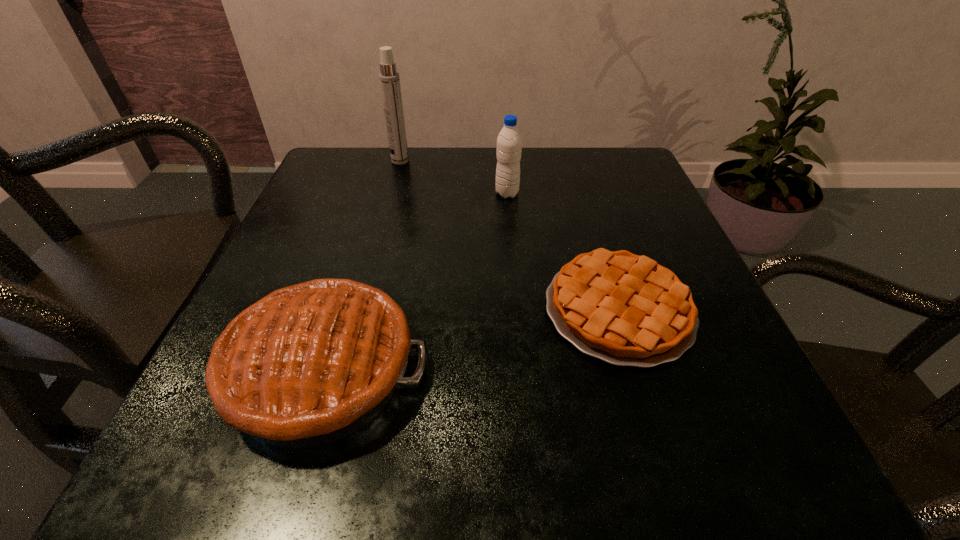
Locate an element on the screen. The image size is (960, 540). vacant region located 0.100m on the back of the taller pie is located at coordinates (355, 264).

The image size is (960, 540). Identify the location of free point located on the left of the rightmost object. (368, 310).

The height and width of the screenshot is (540, 960). What are the coordinates of `aerosol can present at the far edge` in the screenshot? It's located at (389, 78).

Locate an element on the screen. The image size is (960, 540). water bottle at the far edge is located at coordinates (509, 142).

This screenshot has width=960, height=540. In order to click on object at the near edge in this screenshot , I will do `click(308, 364)`.

Find the location of a particular element. This screenshot has height=540, width=960. aerosol can that is at the left edge is located at coordinates (389, 78).

I want to click on pie that is positioned at the left edge, so click(x=308, y=364).

At what (x,y) coordinates should I click in order to perform the action: click on object present at the right edge. Please return your answer as a coordinate pair (x, y). This screenshot has width=960, height=540. Looking at the image, I should click on (625, 309).

In order to click on object that is at the far left corner in this screenshot , I will do `click(389, 78)`.

You are a GUI agent. You are given a task and a screenshot of the screen. Output one action in this format:
    pyautogui.click(x=<x>, y=<y>)
    Task: Click on the object that is at the near left corner
    The width and height of the screenshot is (960, 540).
    Given the screenshot: What is the action you would take?
    pyautogui.click(x=308, y=364)